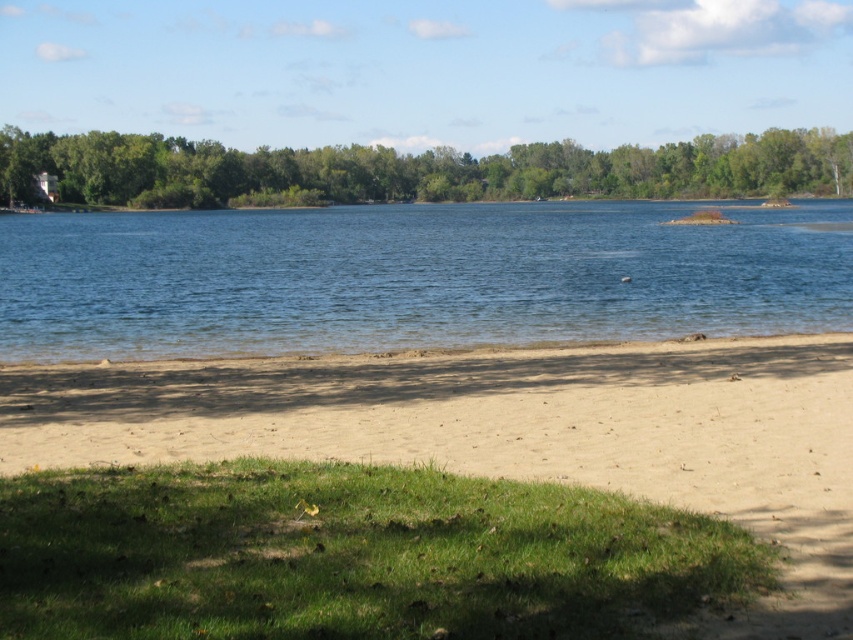
Question: Does light brown sandy beach at lower center have a smaller size compared to blue water at center?

Choices:
 (A) yes
 (B) no

Answer: (A)

Question: Which object is farther from the camera taking this photo?

Choices:
 (A) blue water at center
 (B) light brown sandy beach at lower center

Answer: (A)

Question: Which point appears closest to the camera in this image?

Choices:
 (A) (844, 317)
 (B) (770, 412)
 (C) (157, 134)

Answer: (B)

Question: Among these objects, which one is farthest from the camera?

Choices:
 (A) light brown sandy beach at lower center
 (B) blue water at center
 (C) green leafy tree at upper center

Answer: (C)

Question: From the image, what is the correct spatial relationship of light brown sandy beach at lower center in relation to green leafy tree at upper center?

Choices:
 (A) above
 (B) below

Answer: (B)

Question: Is blue water at center smaller than green leafy tree at upper center?

Choices:
 (A) no
 (B) yes

Answer: (B)